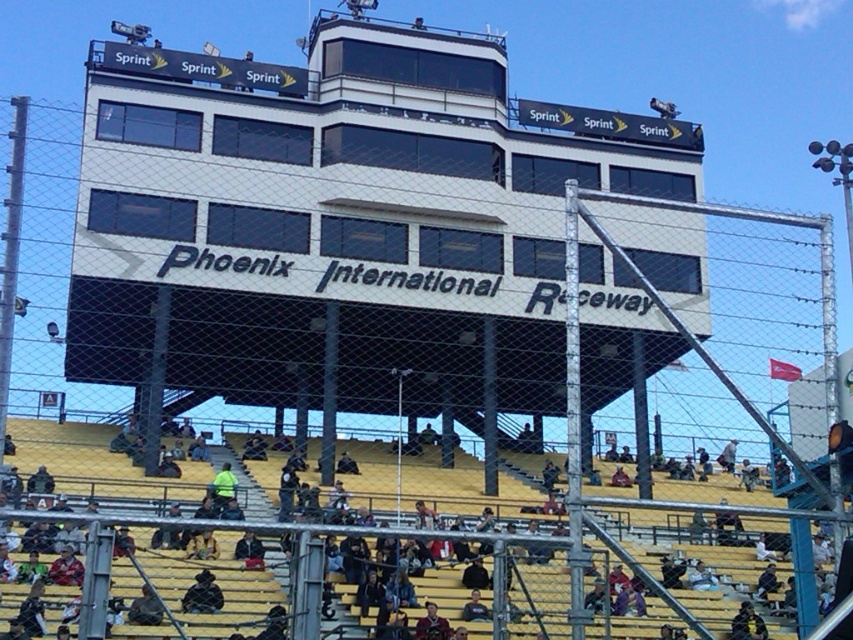
Question: Does yellow wood bleachers at lower center appear over dark blue jacket at lower center?

Choices:
 (A) yes
 (B) no

Answer: (A)

Question: Which point is closer to the camera?

Choices:
 (A) yellow wood bleachers at lower center
 (B) dark gray jacket at lower left
 (C) dark blue jacket at lower center

Answer: (A)

Question: Which object is closer to the camera taking this photo?

Choices:
 (A) dark blue jacket at lower center
 (B) dark gray jacket at lower left

Answer: (B)

Question: Does yellow wood bleachers at lower center come in front of dark blue jacket at lower center?

Choices:
 (A) no
 (B) yes

Answer: (B)

Question: Based on their relative distances, which object is farther from the dark gray jacket at lower left?

Choices:
 (A) yellow wood bleachers at lower center
 (B) dark blue jacket at lower center

Answer: (A)

Question: Can you confirm if dark blue jacket at lower center is wider than dark gray jacket at lower left?

Choices:
 (A) yes
 (B) no

Answer: (A)